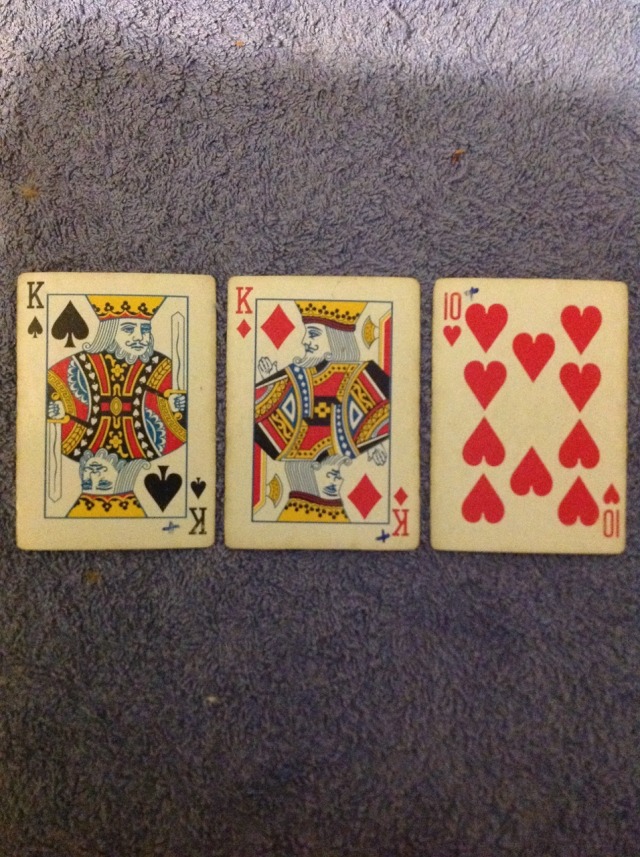
You are a GUI agent. You are given a task and a screenshot of the screen. Output one action in this format:
    pyautogui.click(x=<x>, y=<y>)
    Task: Click on the blue carpet
    This screenshot has height=857, width=640.
    Given the screenshot: What is the action you would take?
    pyautogui.click(x=291, y=195)